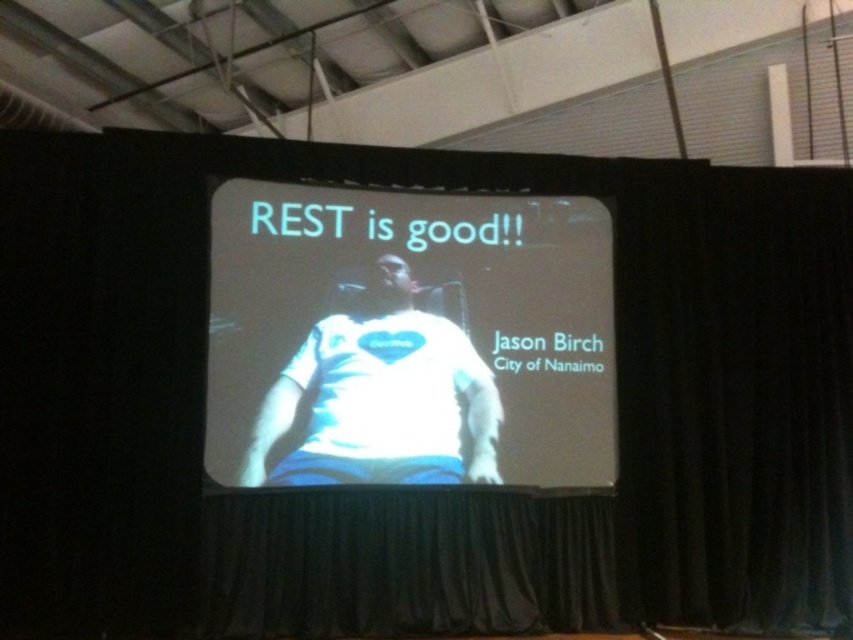
Can you confirm if white glossy projector screen at center is taller than white fabric shirt at center?

Yes, white glossy projector screen at center is taller than white fabric shirt at center.

Does point (292, 230) come in front of point (424, 472)?

No, (292, 230) is further to viewer.

I want to click on white glossy projector screen at center, so click(408, 339).